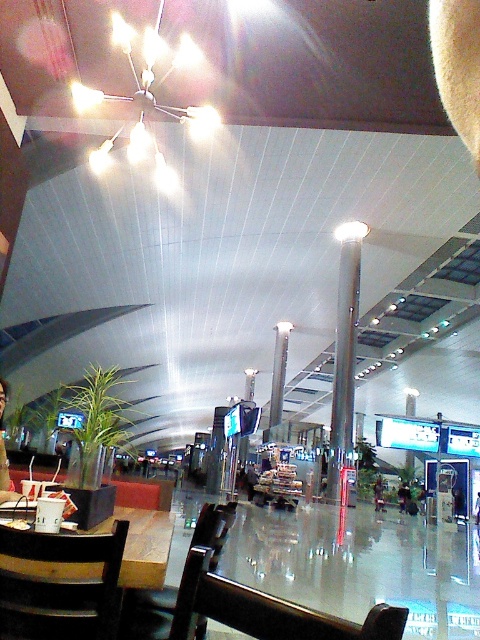
Question: Which point appears farthest from the camera in this image?

Choices:
 (A) click(63, 556)
 (B) click(358, 628)
 (C) click(210, 564)
 (D) click(179, 108)

Answer: (D)

Question: Can you confirm if white glossy chandelier at upper center is positioned to the right of wooden table at center?

Choices:
 (A) yes
 (B) no

Answer: (B)

Question: Can you confirm if wooden chair at lower left is positioned to the left of polished silver pole at center?

Choices:
 (A) yes
 (B) no

Answer: (A)

Question: Which point appears farthest from the camera in this image?

Choices:
 (A) (73, 625)
 (B) (132, 573)
 (C) (402, 634)

Answer: (B)

Question: From the image, what is the correct spatial relationship of white glossy chandelier at upper center in relation to wooden table at center?

Choices:
 (A) below
 (B) above

Answer: (B)

Question: Considering the real-world distances, which object is farthest from the polished silver pole at center?

Choices:
 (A) black plastic chair at center
 (B) white glossy chandelier at upper center

Answer: (A)